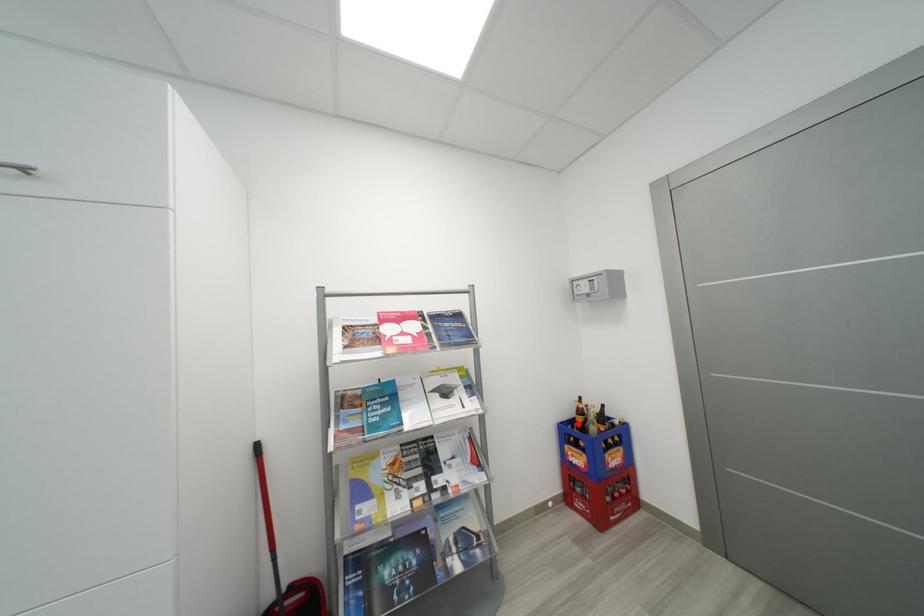
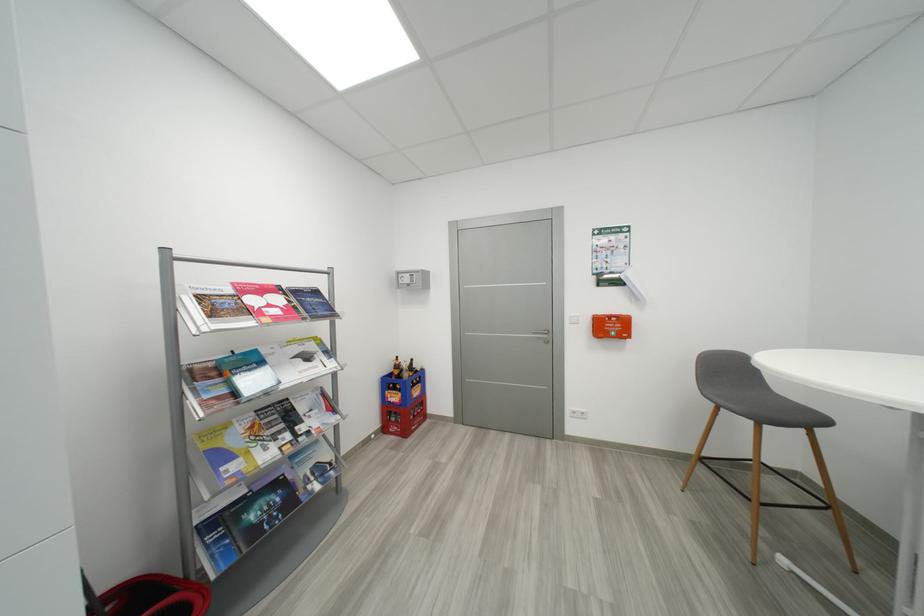
In the second image, find the point that corresponds to the highlighted location in the first image.

(397, 377)